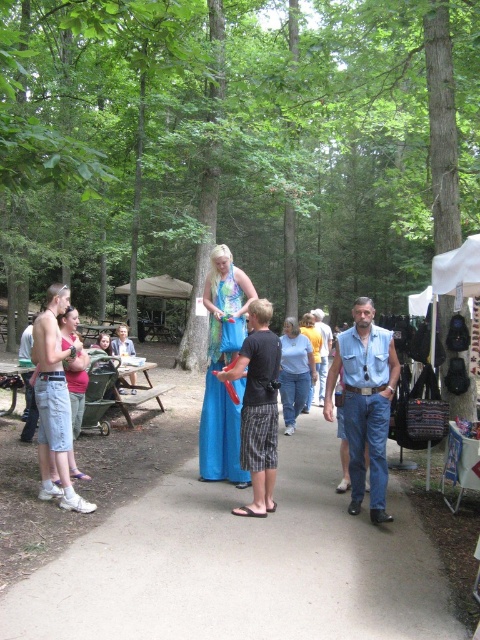
Locate an element on the screen. denim vest at center is located at coordinates (364, 403).

Is denim vest at center smaller than shiny blue fabric dress at center?

Incorrect, denim vest at center is not smaller in size than shiny blue fabric dress at center.

Where is `denim vest at center`? This screenshot has height=640, width=480. denim vest at center is located at coordinates (364, 403).

The height and width of the screenshot is (640, 480). In order to click on denim vest at center in this screenshot , I will do `click(364, 403)`.

Consider the image. Is the position of denim vest at center more distant than that of brown wooden picnic table at left?

No, it is not.

Does denim vest at center appear under brown wooden picnic table at left?

No, denim vest at center is not below brown wooden picnic table at left.

What do you see at coordinates (364, 403) in the screenshot?
I see `denim vest at center` at bounding box center [364, 403].

Image resolution: width=480 pixels, height=640 pixels. I want to click on denim vest at center, so click(x=364, y=403).

Is smooth concrete path at center smaller than denim vest at center?

Yes, smooth concrete path at center is smaller than denim vest at center.

Does smooth concrete path at center have a greater height compared to denim vest at center?

Incorrect, smooth concrete path at center's height is not larger of denim vest at center's.

Locate an element on the screen. This screenshot has height=640, width=480. smooth concrete path at center is located at coordinates (242, 564).

I want to click on smooth concrete path at center, so click(242, 564).